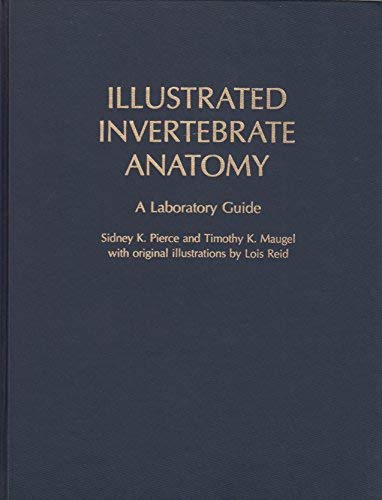
At what (x,y) coordinates should I click in order to perform the action: click on cover. Please return your answer as a coordinate pair (x, y). This screenshot has height=500, width=382. Looking at the image, I should click on point(226,392).